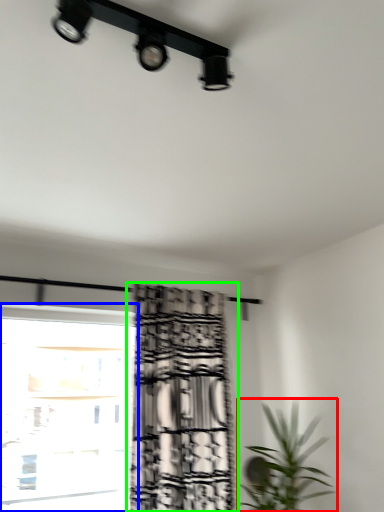
Question: Based on their relative distances, which object is nearer to houseplant (highlighted by a red box)? Choose from window (highlighted by a blue box) and curtain (highlighted by a green box).

Choices:
 (A) window
 (B) curtain

Answer: (B)